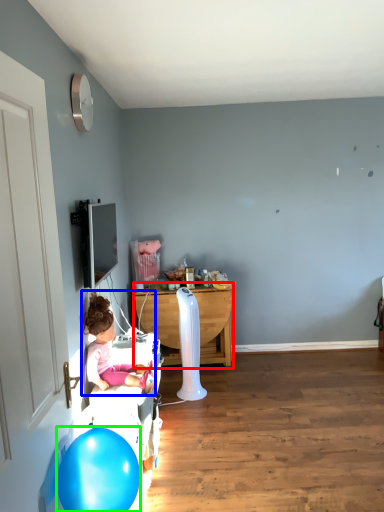
Question: Estimate the real-world distances between objects in this image. Which object is closer to table (highlighted by a red box), person (highlighted by a blue box) or balloon (highlighted by a green box)?

Choices:
 (A) person
 (B) balloon

Answer: (A)